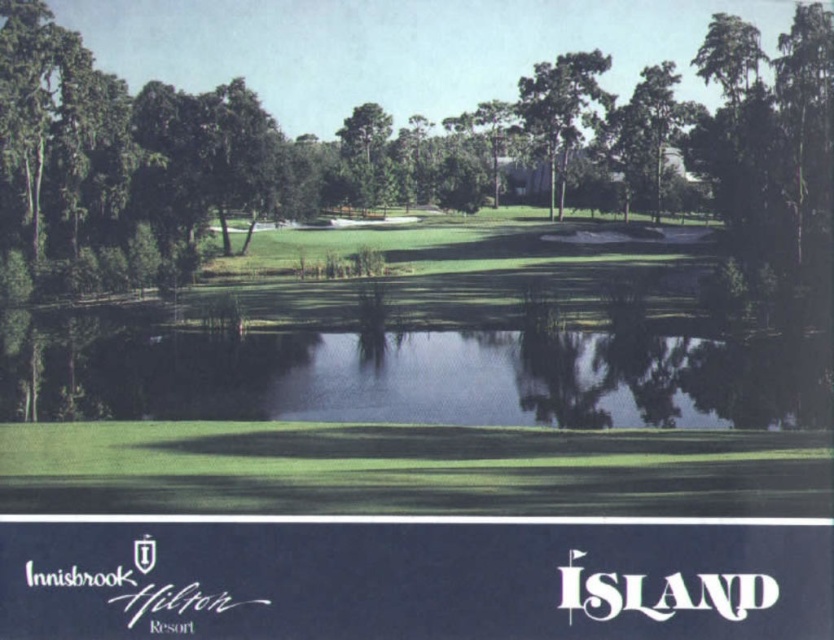
Is green leafy tree at center thinner than green leafy tree at upper center?

In fact, green leafy tree at center might be wider than green leafy tree at upper center.

The height and width of the screenshot is (640, 834). Find the location of `green leafy tree at center`. green leafy tree at center is located at coordinates [384, 150].